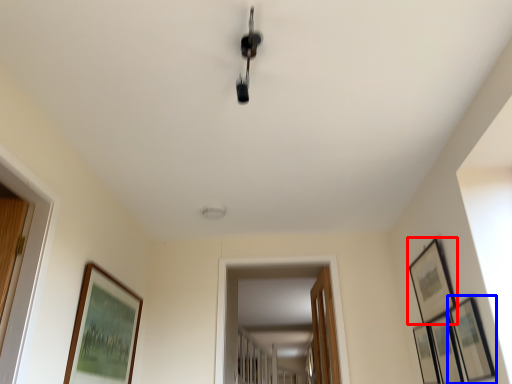
Question: Which of the following is the farthest to the observer, picture frame (highlighted by a red box) or picture frame (highlighted by a blue box)?

Choices:
 (A) picture frame
 (B) picture frame

Answer: (A)